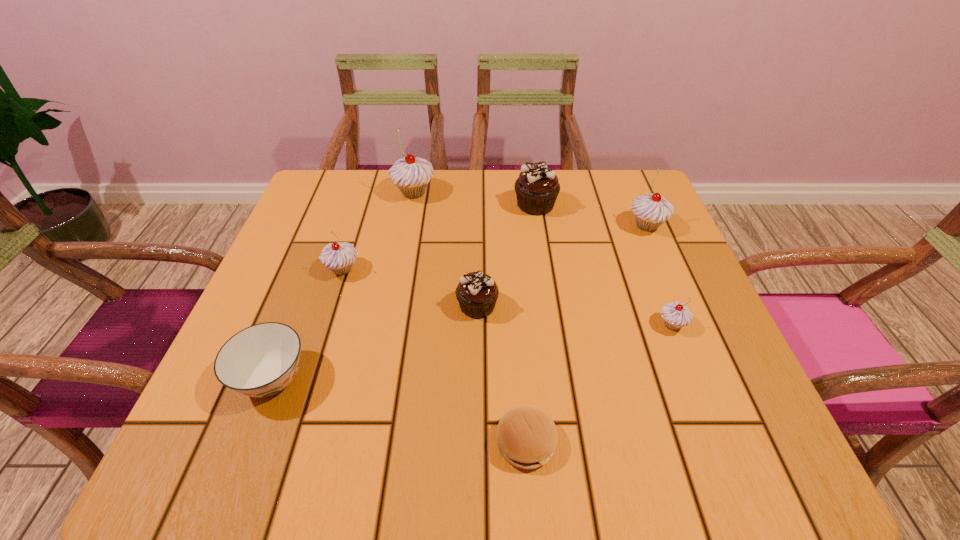
Where is `vacant space located on the right of the shortest object`? This screenshot has width=960, height=540. vacant space located on the right of the shortest object is located at coordinates (593, 442).

Locate an element on the screen. This screenshot has width=960, height=540. object at the near edge is located at coordinates (527, 437).

I want to click on cupcake that is at the left edge, so click(339, 257).

You are a GUI agent. You are given a task and a screenshot of the screen. Output one action in this format:
    pyautogui.click(x=<x>, y=<y>)
    Task: Click on the soup bowl that is at the left edge
    This screenshot has width=960, height=540.
    Given the screenshot: What is the action you would take?
    pyautogui.click(x=261, y=360)

Identify the location of object at the far right corner. This screenshot has width=960, height=540. (651, 210).

In the image, there is a desktop. Where is `free space at the far edge`? free space at the far edge is located at coordinates (385, 208).

In the image, there is a desktop. Where is `vacant space at the near edge`? vacant space at the near edge is located at coordinates (303, 421).

Image resolution: width=960 pixels, height=540 pixels. In order to click on vacant space at the left edge in this screenshot , I will do `click(308, 281)`.

The width and height of the screenshot is (960, 540). What are the coordinates of `free space at the right edge of the desktop` in the screenshot? It's located at (713, 378).

Image resolution: width=960 pixels, height=540 pixels. I want to click on vacant space at the far left corner of the desktop, so click(369, 181).